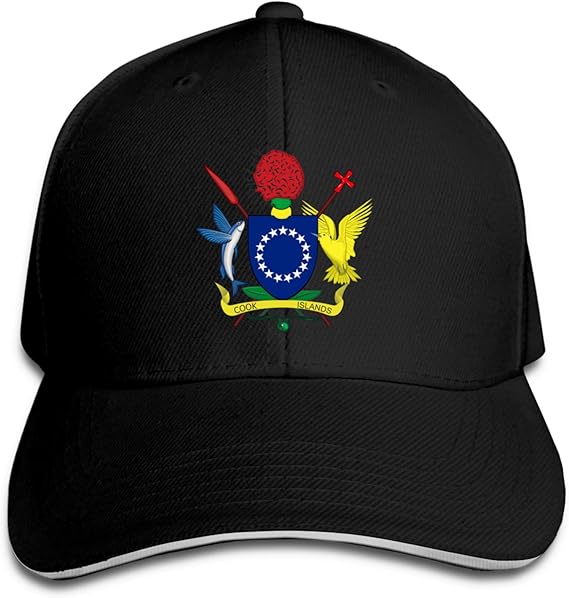
What are the coordinates of `crucifix` in the screenshot? It's located at (345, 178).